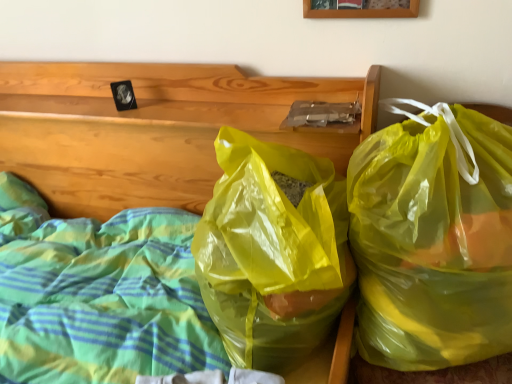
Question: Is translucent plastic bags at center wider or thinner than wooden picture frame at upper center?

Choices:
 (A) wide
 (B) thin

Answer: (A)

Question: Relative to wooden picture frame at upper center, is translucent plastic bags at center in front or behind?

Choices:
 (A) behind
 (B) front

Answer: (B)

Question: Based on their relative distances, which object is nearer to the translucent plastic bags at center?

Choices:
 (A) wooden picture frame at upper center
 (B) yellow translucent bag at right

Answer: (B)

Question: Which object is positioned farthest from the translucent plastic bags at center?

Choices:
 (A) wooden picture frame at upper center
 (B) yellow translucent bag at right

Answer: (A)